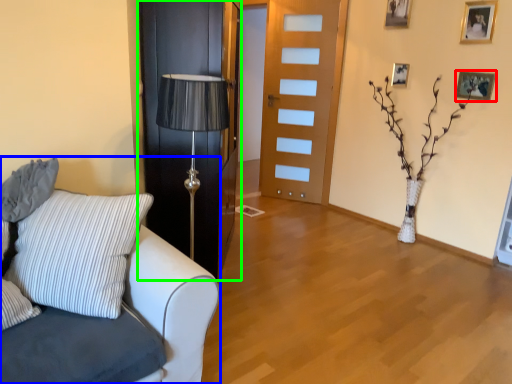
Question: Considering the real-world distances, which object is farthest from picture frame (highlighted by a red box)? studio couch (highlighted by a blue box) or door (highlighted by a green box)?

Choices:
 (A) studio couch
 (B) door

Answer: (A)